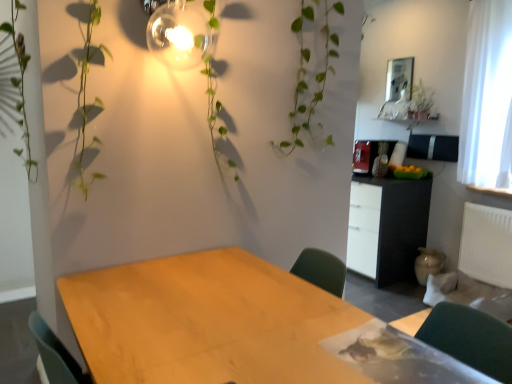
Describe the element at coordinates (181, 35) in the screenshot. The height and width of the screenshot is (384, 512). I see `matte glass light fixture at upper center` at that location.

Image resolution: width=512 pixels, height=384 pixels. I want to click on metallic silver picture frame at upper right, so click(x=399, y=78).

What do you see at coordinates (487, 97) in the screenshot? The width and height of the screenshot is (512, 384). I see `white sheer curtain at right` at bounding box center [487, 97].

Where is `white sheer curtain at right`? white sheer curtain at right is located at coordinates (487, 97).

Find the location of a particular element. Image resolution: width=512 pixels, height=384 pixels. matte glass light fixture at upper center is located at coordinates (181, 35).

Is point (503, 7) closer to camera compared to point (192, 50)?

No.

Is white sheer curtain at right in contact with matte glass light fixture at upper center?

white sheer curtain at right and matte glass light fixture at upper center are clearly separated.

What's the angular difference between white sheer curtain at right and matte glass light fixture at upper center's facing directions?

The angle between the facing direction of white sheer curtain at right and the facing direction of matte glass light fixture at upper center is 90.5 degrees.

Is white sheer curtain at right to the left or to the right of matte glass light fixture at upper center in the image?

In the image, white sheer curtain at right appears on the right side of matte glass light fixture at upper center.

Is white sheer curtain at right at the back of wooden table at center?

No, white sheer curtain at right is not at the back of wooden table at center.

Considering the sizes of objects wooden table at center and white sheer curtain at right in the image provided, who is smaller, wooden table at center or white sheer curtain at right?

white sheer curtain at right is smaller.

Would you say wooden table at center is outside white sheer curtain at right?

Yes, wooden table at center is outside of white sheer curtain at right.

Is matte glass light fixture at upper center not near wooden table at center?

Indeed, matte glass light fixture at upper center is not near wooden table at center.

Can you confirm if matte glass light fixture at upper center is thinner than wooden table at center?

Indeed, matte glass light fixture at upper center has a lesser width compared to wooden table at center.

How different are the orientations of matte glass light fixture at upper center and wooden table at center in degrees?

89.3 degrees separate the facing orientations of matte glass light fixture at upper center and wooden table at center.

Image resolution: width=512 pixels, height=384 pixels. I want to click on table in front of the matte glass light fixture at upper center, so click(237, 327).

Considering the relative sizes of wooden table at center and matte glass light fixture at upper center in the image provided, is wooden table at center smaller than matte glass light fixture at upper center?

Actually, wooden table at center might be larger than matte glass light fixture at upper center.

This screenshot has height=384, width=512. Identify the location of light fixture behind the wooden table at center. (181, 35).

Can you confirm if wooden table at center is taller than matte glass light fixture at upper center?

Indeed, wooden table at center has a greater height compared to matte glass light fixture at upper center.

Visually, is wooden table at center positioned to the left or to the right of matte glass light fixture at upper center?

wooden table at center is to the right of matte glass light fixture at upper center.

Which is in front, point (475, 276) or point (410, 272)?

Positioned in front is point (475, 276).

Would you say white plastic radiator at right is to the left or to the right of black matte cabinet at center right in the picture?

From the image, it's evident that white plastic radiator at right is to the right of black matte cabinet at center right.

From their relative heights in the image, would you say white plastic radiator at right is taller or shorter than black matte cabinet at center right?

Considering their sizes, white plastic radiator at right has less height than black matte cabinet at center right.

Would you consider white plastic radiator at right to be distant from black matte cabinet at center right?

No.

From the image's perspective, who appears lower, wooden table at center or white plastic radiator at right?

wooden table at center, from the image's perspective.

Who is taller, wooden table at center or white plastic radiator at right?

Standing taller between the two is wooden table at center.

Looking at this image, is wooden table at center next to white plastic radiator at right and touching it?

They are not placed beside each other.

Can you confirm if wooden table at center is wider than white plastic radiator at right?

Yes, wooden table at center is wider than white plastic radiator at right.

Is black matte cabinet at center right bigger than wooden table at center?

No, black matte cabinet at center right is not bigger than wooden table at center.

From the picture: How many degrees apart are the facing directions of black matte cabinet at center right and wooden table at center?

180 degrees separate the facing orientations of black matte cabinet at center right and wooden table at center.

Considering the relative positions of black matte cabinet at center right and wooden table at center in the image provided, is black matte cabinet at center right to the left of wooden table at center from the viewer's perspective?

No, black matte cabinet at center right is not to the left of wooden table at center.

Which is in front, black matte cabinet at center right or wooden table at center?

Positioned in front is wooden table at center.

Where is `light fixture above the white sheer curtain at right (from a real-world perspective)`? light fixture above the white sheer curtain at right (from a real-world perspective) is located at coordinates (181, 35).

What are the coordinates of `curtain behind the wooden table at center` in the screenshot? It's located at (487, 97).

Which object lies further to the anchor point white plastic radiator at right, black matte cabinet at center right or white sheer curtain at right?

white sheer curtain at right.

From the image, which object appears to be nearer to white sheer curtain at right, black matte cabinet at center right or wooden table at center?

black matte cabinet at center right is positioned closer to the anchor white sheer curtain at right.

Based on the photo, considering their positions, is white sheer curtain at right positioned closer to matte glass light fixture at upper center than metallic silver picture frame at upper right?

white sheer curtain at right is closer to matte glass light fixture at upper center.

Considering their positions, is matte glass light fixture at upper center positioned further to wooden table at center than black matte cabinet at center right?

black matte cabinet at center right is further to wooden table at center.

From the image, which object appears to be nearer to wooden table at center, matte glass light fixture at upper center or white sheer curtain at right?

Among the two, matte glass light fixture at upper center is located nearer to wooden table at center.

Which object lies further to the anchor point white sheer curtain at right, metallic silver picture frame at upper right or matte glass light fixture at upper center?

The object further to white sheer curtain at right is matte glass light fixture at upper center.

Estimate the real-world distances between objects in this image. Which object is further from matte glass light fixture at upper center, white plastic radiator at right or white sheer curtain at right?

Based on the image, white plastic radiator at right appears to be further to matte glass light fixture at upper center.

Based on their spatial positions, is white plastic radiator at right or white sheer curtain at right closer to metallic silver picture frame at upper right?

The object closer to metallic silver picture frame at upper right is white sheer curtain at right.

The image size is (512, 384). I want to click on cabinetry between matte glass light fixture at upper center and white sheer curtain at right from left to right, so click(x=387, y=226).

Image resolution: width=512 pixels, height=384 pixels. In order to click on cabinetry between white sheer curtain at right and white plastic radiator at right from top to bottom in this screenshot , I will do `click(387, 226)`.

At what (x,y) coordinates should I click in order to perform the action: click on curtain situated between matte glass light fixture at upper center and white plastic radiator at right from left to right. Please return your answer as a coordinate pair (x, y). Looking at the image, I should click on (487, 97).

The width and height of the screenshot is (512, 384). I want to click on light fixture between wooden table at center and metallic silver picture frame at upper right from front to back, so click(181, 35).